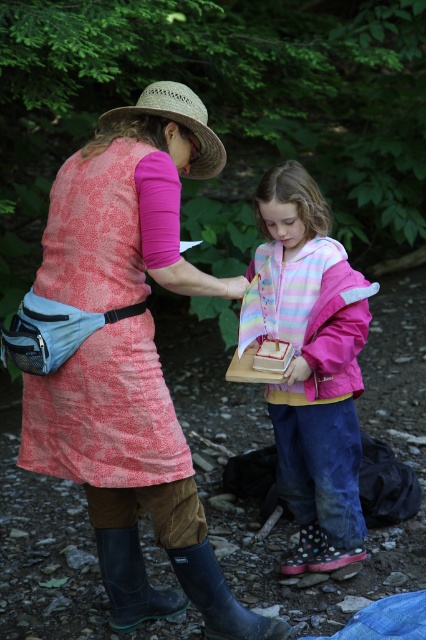
Question: Can you confirm if matte pink dress at center is positioned to the left of rubber boots at lower center?

Choices:
 (A) yes
 (B) no

Answer: (A)

Question: Which point appears closest to the camera in this image?

Choices:
 (A) (285, 337)
 (B) (219, 584)

Answer: (B)

Question: Considering the relative positions of pink fabric jacket at center and rubber boots at lower center in the image provided, where is pink fabric jacket at center located with respect to rubber boots at lower center?

Choices:
 (A) left
 (B) right

Answer: (B)

Question: Does pink fabric jacket at center have a greater width compared to rubber boots at lower left?

Choices:
 (A) no
 (B) yes

Answer: (B)

Question: Which object is the farthest from the patterned fabric dress at left?

Choices:
 (A) strawmaterial/texturehat at upper left
 (B) rubber boots at lower left
 (C) matte pink dress at center
 (D) rubber boots at lower center

Answer: (A)

Question: Which object is the closest to the pink fabric jacket at center?

Choices:
 (A) rubber boots at lower left
 (B) rubber boots at lower center

Answer: (B)